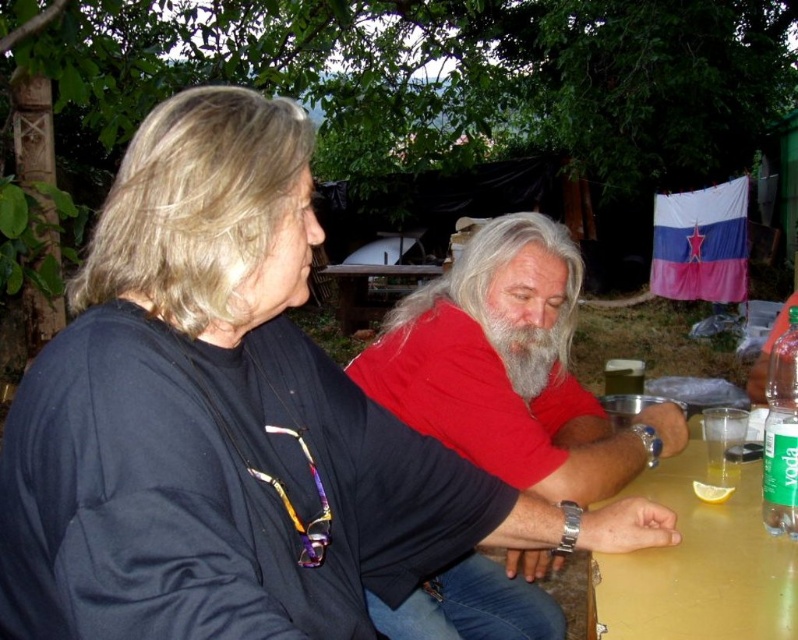
You are a waiter serving drinks to the two people at the yellow matte table at lower right. You need to place a small pitcher of lemonade on the table. Where should you place it so it doesn not block the yellow citrus slice at table right?

Place the pitcher away from the yellow citrus slice at table right since the yellow matte table at lower right is in front of it, meaning the citrus slice is behind the table from your perspective. Wait, the description says the table is in front of the citrus slice. Hmm, maybe I need to rephrase. Wait, the Objects Description states that the yellow matte table at lower right is in front of the yellow citrus slice at table right. That would mean the citrus slice is behind the table? But tables are usually a

You are a delivery robot with a 20 feet long package that needs to be placed between the graywoollybeard at center and the wooden table at center. Can the package fit in the space between them?

The distance between the graywoollybeard at center and the wooden table at center is 18.84 feet. Since the package is 20 feet long, it cannot fit in the space between them.